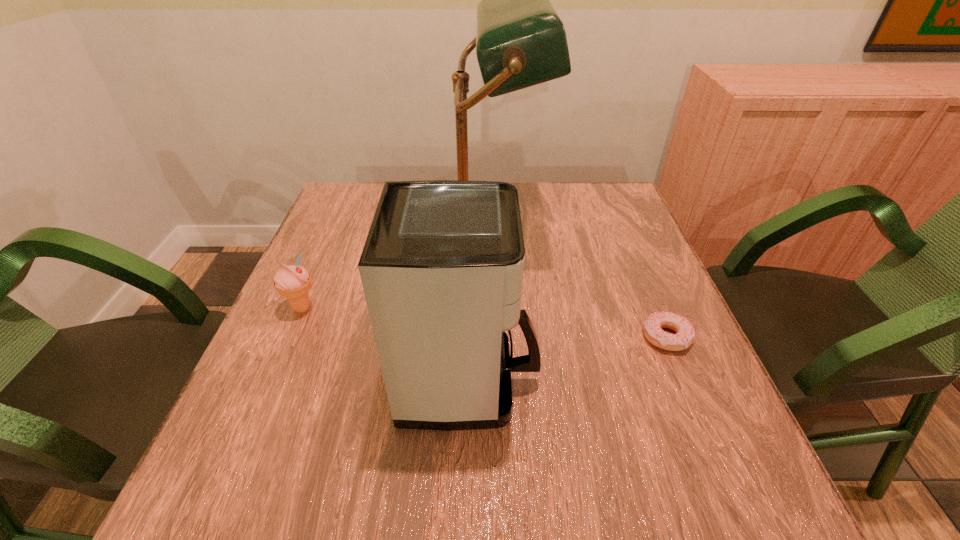
I want to click on the farthest object, so click(x=520, y=41).

Identify the location of the tallest object. (520, 41).

This screenshot has width=960, height=540. Identify the location of coffee maker. pyautogui.click(x=442, y=267).

Locate an element on the screen. the third tallest object is located at coordinates (292, 282).

I want to click on icecream, so click(292, 282).

I want to click on the rightmost object, so click(x=653, y=325).

The width and height of the screenshot is (960, 540). Identify the location of the shortest object. (653, 325).

I want to click on vacant region located above the green lampshade of the table lamp, so click(x=623, y=232).

Where is `free space located 0.100m on the front panel of the coffee maker`? This screenshot has width=960, height=540. free space located 0.100m on the front panel of the coffee maker is located at coordinates (591, 380).

In order to click on vacant region located on the front of the second shortest object in this screenshot , I will do tap(281, 358).